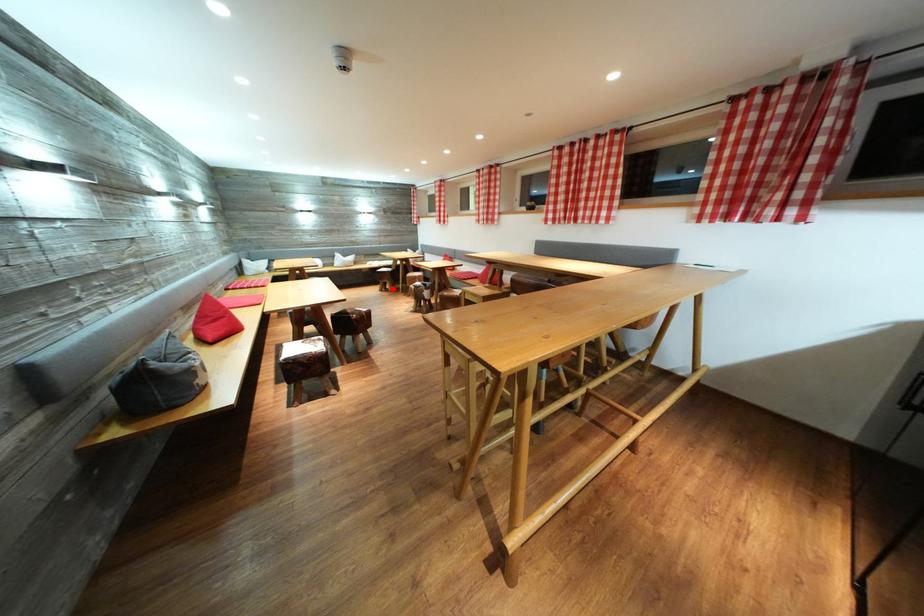
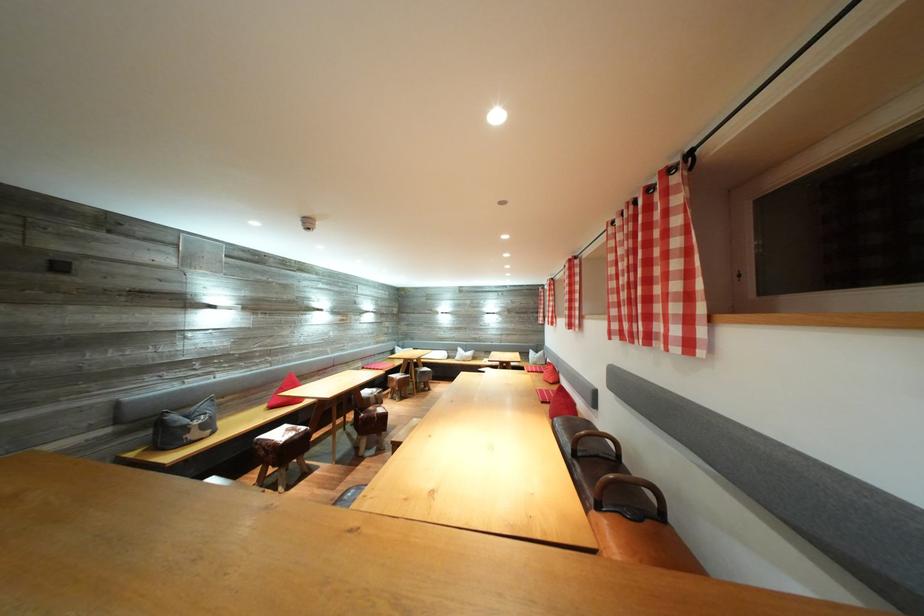
Question: I am providing you with two images of the same scene from different viewpoints. A red point is marked on the first image. Can you still see the location of the red point in image 2?

Choices:
 (A) Yes
 (B) No

Answer: (B)